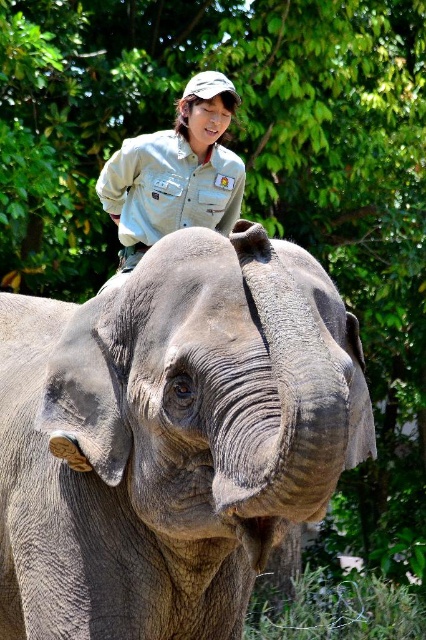
Question: Can you confirm if gray textured elephant at center is positioned to the left of light brown uniform at upper center?

Choices:
 (A) yes
 (B) no

Answer: (B)

Question: Can you confirm if gray textured elephant at center is bigger than light brown uniform at upper center?

Choices:
 (A) no
 (B) yes

Answer: (B)

Question: Does gray textured elephant at center have a larger size compared to light brown uniform at upper center?

Choices:
 (A) yes
 (B) no

Answer: (A)